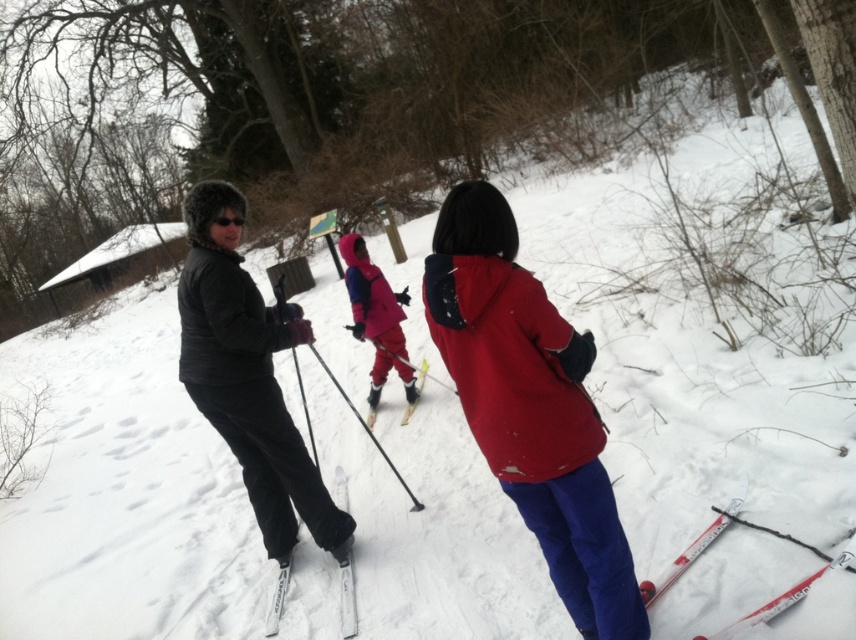
You are a photographer trying to capture a clear photo of the matte red jacket at center and the white matte ski at center. Based on their positions, which object will appear closer to the camera in the photo?

The matte red jacket at center will appear closer to the camera in the photo because it is in front of the white matte ski at center according to their spatial arrangement.

You are a photographer wanting to capture a closeup shot of the matte pink snowsuit at center and the yellow matte ski at center. Can you fit both subjects within your camera frame if your camera has a maximum field of view of 18 inches?

The distance between the matte pink snowsuit at center and the yellow matte ski at center is 18.80 inches, which exceeds the camera frame of 18 inches. Therefore, you cannot fit both subjects within the camera frame.